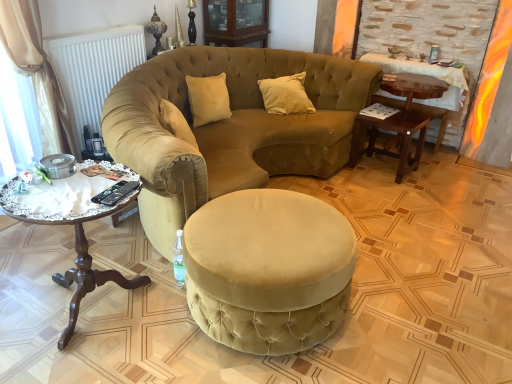
The image size is (512, 384). What are the coordinates of `free space in front of black plastic remote control at lower left` in the screenshot? It's located at (99, 211).